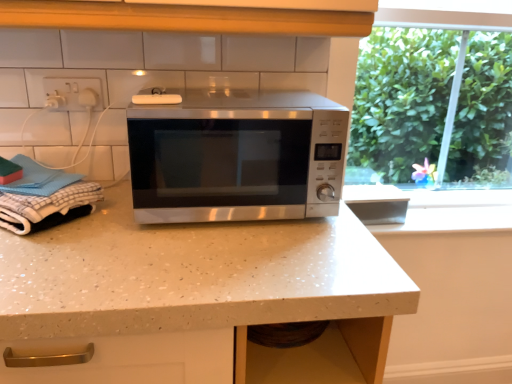
Question: Could white checkered cloth at left be considered to be inside white speckled laminate countertop at center?

Choices:
 (A) yes
 (B) no

Answer: (B)

Question: Is white speckled laminate countertop at center not within white checkered cloth at left?

Choices:
 (A) yes
 (B) no

Answer: (A)

Question: Is white speckled laminate countertop at center placed right next to white checkered cloth at left?

Choices:
 (A) yes
 (B) no

Answer: (B)

Question: From a real-world perspective, is white speckled laminate countertop at center beneath white checkered cloth at left?

Choices:
 (A) yes
 (B) no

Answer: (A)

Question: Can you confirm if white speckled laminate countertop at center is taller than white checkered cloth at left?

Choices:
 (A) yes
 (B) no

Answer: (A)

Question: Is white checkered cloth at left at the back of white speckled laminate countertop at center?

Choices:
 (A) no
 (B) yes

Answer: (A)

Question: Is stainless steel microwave at center wider than white checkered cloth at left?

Choices:
 (A) no
 (B) yes

Answer: (B)

Question: Is stainless steel microwave at center looking in the opposite direction of white checkered cloth at left?

Choices:
 (A) yes
 (B) no

Answer: (B)

Question: Is the position of stainless steel microwave at center less distant than that of white checkered cloth at left?

Choices:
 (A) no
 (B) yes

Answer: (A)

Question: From a real-world perspective, is stainless steel microwave at center physically below white checkered cloth at left?

Choices:
 (A) no
 (B) yes

Answer: (A)

Question: Does stainless steel microwave at center have a greater height compared to white checkered cloth at left?

Choices:
 (A) yes
 (B) no

Answer: (A)

Question: Is stainless steel microwave at center thinner than white checkered cloth at left?

Choices:
 (A) no
 (B) yes

Answer: (A)

Question: Is white plastic socket at upper left outside of white checkered cloth at left?

Choices:
 (A) yes
 (B) no

Answer: (A)